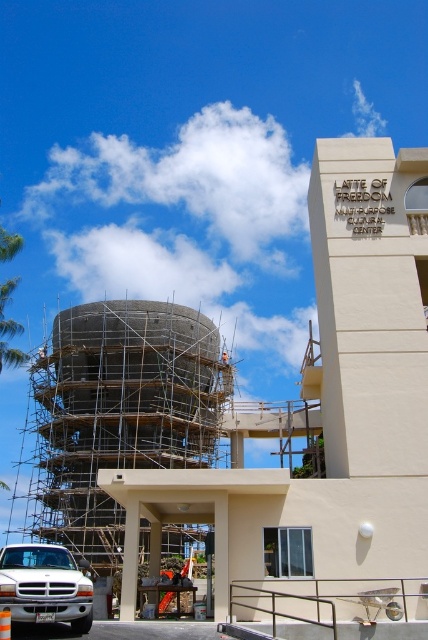
Question: From the image, what is the correct spatial relationship of green leafy palm tree at left in relation to orange safety vest at center?

Choices:
 (A) below
 (B) above

Answer: (B)

Question: Estimate the real-world distances between objects in this image. Which object is closer to the green leafy palm tree at left?

Choices:
 (A) white matte truck at lower left
 (B) scaffolding at center

Answer: (B)

Question: Does green leafy palm tree at left have a larger size compared to orange safety vest at center?

Choices:
 (A) yes
 (B) no

Answer: (A)

Question: Which of the following is the farthest from the observer?

Choices:
 (A) (11, 352)
 (B) (223, 355)
 (C) (32, 560)
 (D) (169, 355)

Answer: (B)

Question: Estimate the real-world distances between objects in this image. Which object is closer to the white matte truck at lower left?

Choices:
 (A) green leafy palm tree at left
 (B) orange safety vest at center

Answer: (A)

Question: In this image, where is scaffolding at center located relative to orange safety vest at center?

Choices:
 (A) right
 (B) left

Answer: (B)